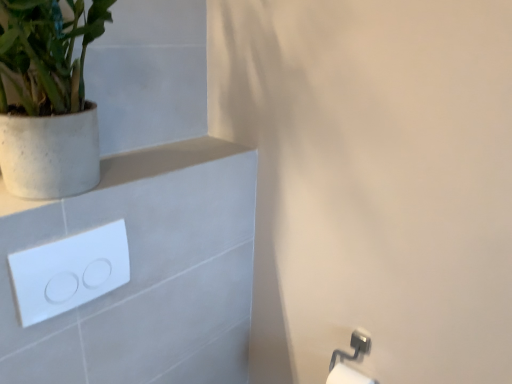
Question: Does white glossy/light switch at upper left come behind white speckled concrete pot at upper left?

Choices:
 (A) no
 (B) yes

Answer: (B)

Question: Is white glossy/light switch at upper left positioned with its back to white speckled concrete pot at upper left?

Choices:
 (A) no
 (B) yes

Answer: (A)

Question: From the image's perspective, is white glossy/light switch at upper left beneath white speckled concrete pot at upper left?

Choices:
 (A) no
 (B) yes

Answer: (B)

Question: Can you confirm if white glossy/light switch at upper left is positioned to the right of white speckled concrete pot at upper left?

Choices:
 (A) no
 (B) yes

Answer: (B)

Question: Could you tell me if white glossy/light switch at upper left is turned towards white speckled concrete pot at upper left?

Choices:
 (A) yes
 (B) no

Answer: (B)

Question: Is white glossy/light switch at upper left to the left or to the right of white glossy toilet paper at lower right in the image?

Choices:
 (A) right
 (B) left

Answer: (B)

Question: Considering the positions of white glossy/light switch at upper left and white glossy toilet paper at lower right in the image, is white glossy/light switch at upper left wider or thinner than white glossy toilet paper at lower right?

Choices:
 (A) wide
 (B) thin

Answer: (B)

Question: Considering the positions of point (27, 294) and point (336, 364), is point (27, 294) closer or farther from the camera than point (336, 364)?

Choices:
 (A) farther
 (B) closer

Answer: (B)

Question: From the image's perspective, is white glossy/light switch at upper left positioned above or below white glossy toilet paper at lower right?

Choices:
 (A) above
 (B) below

Answer: (A)

Question: In the image, is white speckled concrete pot at upper left positioned in front of or behind white matte concrete at upper left?

Choices:
 (A) behind
 (B) front

Answer: (B)

Question: Is white speckled concrete pot at upper left taller or shorter than white matte concrete at upper left?

Choices:
 (A) short
 (B) tall

Answer: (B)

Question: Does point (5, 150) appear closer or farther from the camera than point (144, 155)?

Choices:
 (A) closer
 (B) farther

Answer: (A)

Question: Based on their sizes in the image, would you say white speckled concrete pot at upper left is bigger or smaller than white matte concrete at upper left?

Choices:
 (A) small
 (B) big

Answer: (B)

Question: Choose the correct answer: Is white speckled concrete pot at upper left inside white glossy/light switch at upper left or outside it?

Choices:
 (A) outside
 (B) inside

Answer: (A)

Question: Considering their positions, is white speckled concrete pot at upper left located in front of or behind white glossy/light switch at upper left?

Choices:
 (A) behind
 (B) front

Answer: (B)